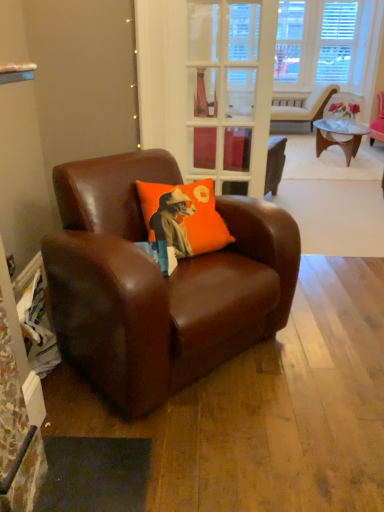
Question: Are brown leather chair at left, the 1th chair viewed from the front, and matte brown armchair at upper right, the second chair positioned from the bottom, far apart?

Choices:
 (A) no
 (B) yes

Answer: (B)

Question: Can you confirm if brown leather chair at left, the 1th chair viewed from the front, is positioned to the left of matte brown armchair at upper right, which is counted as the first chair, starting from the right?

Choices:
 (A) yes
 (B) no

Answer: (A)

Question: Considering the relative sizes of brown leather chair at left, which is the second chair from right to left, and matte brown armchair at upper right, which is counted as the first chair, starting from the right, in the image provided, is brown leather chair at left, which is the second chair from right to left, wider than matte brown armchair at upper right, which is counted as the first chair, starting from the right,?

Choices:
 (A) no
 (B) yes

Answer: (B)

Question: Does brown leather chair at left, arranged as the first chair when viewed from the left, appear on the right side of matte brown armchair at upper right, positioned as the 2th chair in front-to-back order?

Choices:
 (A) no
 (B) yes

Answer: (A)

Question: Is brown leather chair at left, which is the second chair from right to left, placed right next to matte brown armchair at upper right, positioned as the 2th chair in front-to-back order?

Choices:
 (A) yes
 (B) no

Answer: (B)

Question: From the image's perspective, is matte brown armchair at upper right, which is counted as the first chair, starting from the right, above or below brown leather chair at left, the 1th chair viewed from the front?

Choices:
 (A) below
 (B) above

Answer: (B)

Question: Considering the positions of matte brown armchair at upper right, the second chair positioned from the bottom, and brown leather chair at left, which ranks as the first chair in bottom-to-top order, in the image, is matte brown armchair at upper right, the second chair positioned from the bottom, bigger or smaller than brown leather chair at left, which ranks as the first chair in bottom-to-top order,?

Choices:
 (A) small
 (B) big

Answer: (A)

Question: Considering the relative positions of matte brown armchair at upper right, which is counted as the first chair, starting from the top, and brown leather chair at left, which is the second chair from right to left, in the image provided, is matte brown armchair at upper right, which is counted as the first chair, starting from the top, to the left or to the right of brown leather chair at left, which is the second chair from right to left,?

Choices:
 (A) left
 (B) right

Answer: (B)

Question: In terms of width, does matte brown armchair at upper right, which is counted as the first chair, starting from the top, look wider or thinner when compared to brown leather chair at left, arranged as the first chair when viewed from the left?

Choices:
 (A) wide
 (B) thin

Answer: (B)

Question: Considering the positions of point (301, 112) and point (206, 49), is point (301, 112) closer or farther from the camera than point (206, 49)?

Choices:
 (A) closer
 (B) farther

Answer: (B)

Question: From a real-world perspective, is matte brown armchair at upper right, which appears as the first chair when viewed from the back, above or below clear glass door at center?

Choices:
 (A) below
 (B) above

Answer: (A)

Question: From the image's perspective, is matte brown armchair at upper right, which appears as the first chair when viewed from the back, above or below clear glass door at center?

Choices:
 (A) below
 (B) above

Answer: (B)

Question: Is matte brown armchair at upper right, which is counted as the first chair, starting from the right, in front of or behind clear glass door at center in the image?

Choices:
 (A) behind
 (B) front

Answer: (A)

Question: From a real-world perspective, is orange fabric pillow at center above or below matte brown armchair at upper right, which is counted as the first chair, starting from the top?

Choices:
 (A) above
 (B) below

Answer: (A)

Question: Would you say orange fabric pillow at center is inside or outside matte brown armchair at upper right, which is counted as the first chair, starting from the top?

Choices:
 (A) outside
 (B) inside

Answer: (A)